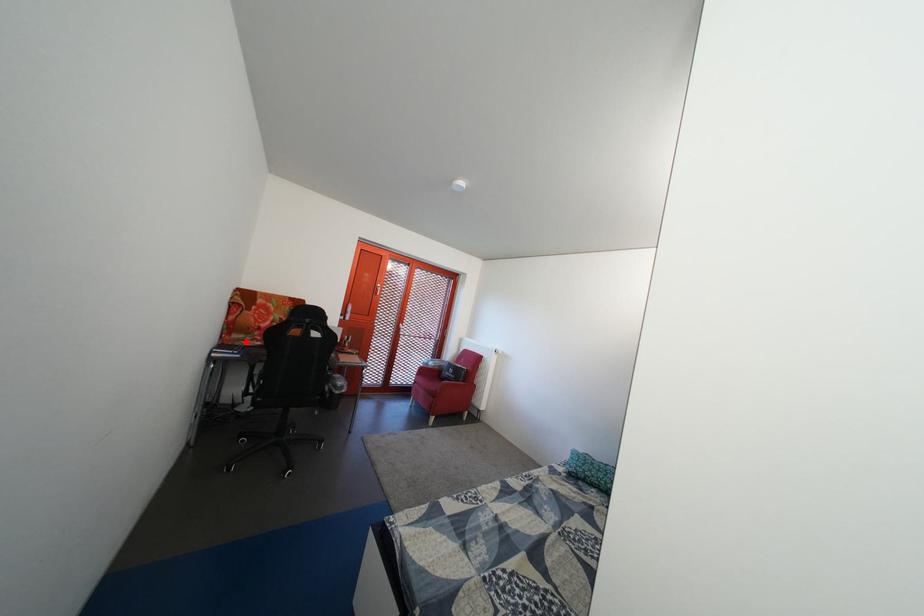
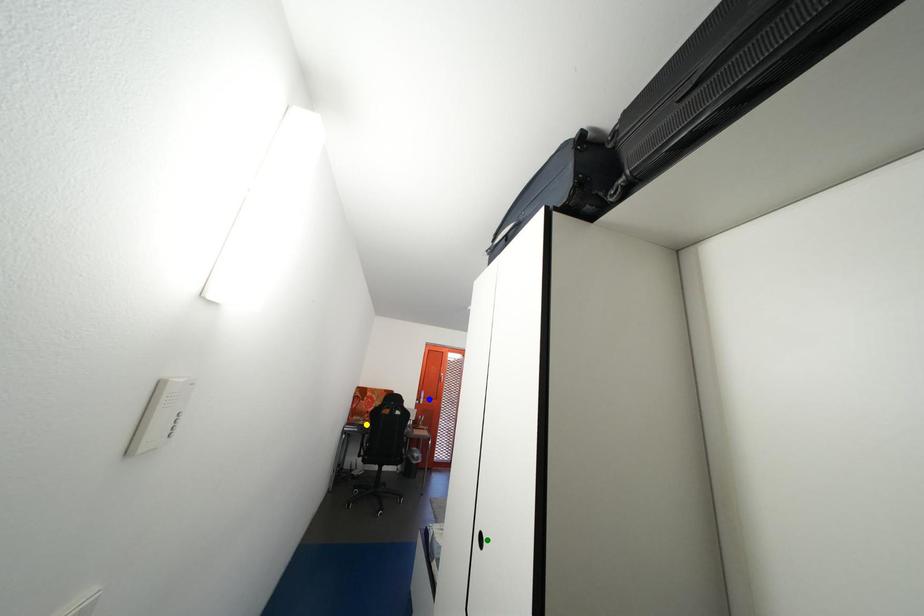
Question: I am providing you with two images of the same scene from different viewpoints. A red point is marked on the first image. You are given multiple points on the second image. Which point in image 2 is actually the same real-world point as the red point in image 1?

Choices:
 (A) blue point
 (B) green point
 (C) yellow point

Answer: (C)